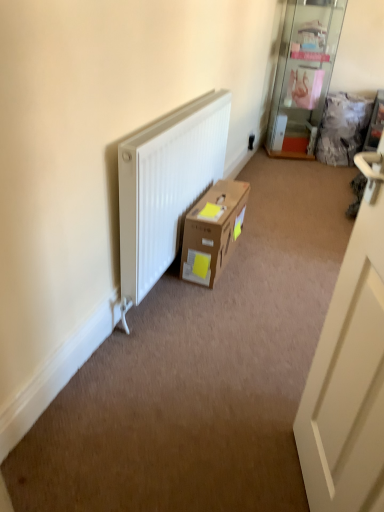
Describe the element at coordinates (303, 75) in the screenshot. I see `transparent glass shelf at upper right` at that location.

Locate an element on the screen. The width and height of the screenshot is (384, 512). white matte door at right is located at coordinates (349, 370).

Where is `brown cardboard box at center`? brown cardboard box at center is located at coordinates (213, 232).

Considering the relative sizes of brown cardboard box at center and transparent glass shelf at upper right in the image provided, is brown cardboard box at center smaller than transparent glass shelf at upper right?

Correct, brown cardboard box at center occupies less space than transparent glass shelf at upper right.

Is point (224, 192) more distant than point (299, 126)?

No, it is in front of (299, 126).

In the image, is brown cardboard box at center positioned in front of or behind transparent glass shelf at upper right?

brown cardboard box at center is positioned closer to the viewer than transparent glass shelf at upper right.

Considering the positions of objects transparent glass shelf at upper right and white matte door at right in the image provided, who is more to the left, transparent glass shelf at upper right or white matte door at right?

From the viewer's perspective, white matte door at right appears more on the left side.

Who is shorter, transparent glass shelf at upper right or white matte door at right?

transparent glass shelf at upper right is shorter.

From a real-world perspective, is transparent glass shelf at upper right above or below white matte door at right?

transparent glass shelf at upper right is situated lower than white matte door at right in the real world.

Is transparent glass shelf at upper right oriented towards white matte door at right?

Yes, transparent glass shelf at upper right faces towards white matte door at right.

Is transparent glass shelf at upper right positioned far away from brown cardboard box at center?

Indeed, transparent glass shelf at upper right is not near brown cardboard box at center.

Is transparent glass shelf at upper right facing towards brown cardboard box at center?

Yes, transparent glass shelf at upper right is facing brown cardboard box at center.

Is transparent glass shelf at upper right completely or partially outside of brown cardboard box at center?

Yes.

Considering the positions of objects transparent glass shelf at upper right and brown cardboard box at center in the image provided, who is in front, transparent glass shelf at upper right or brown cardboard box at center?

Result: brown cardboard box at center is closer to the camera.

Based on the photo, from a real-world perspective, which is physically below, brown cardboard box at center or white matte door at right?

From a 3D spatial view, brown cardboard box at center is below.

Does point (227, 223) appear closer or farther from the camera than point (357, 403)?

Point (227, 223).

At what (x,y) coordinates should I click in order to perform the action: click on door on the right of brown cardboard box at center. Please return your answer as a coordinate pair (x, y). This screenshot has width=384, height=512. Looking at the image, I should click on (349, 370).

Which of these two, white matte door at right or brown cardboard box at center, is thinner?

With smaller width is white matte door at right.

Between white matte door at right and brown cardboard box at center, which one has larger size?

white matte door at right.

Which of these two, white matte door at right or brown cardboard box at center, stands shorter?

With less height is brown cardboard box at center.

Is white matte door at right facing away from transparent glass shelf at upper right?

No, white matte door at right is not facing the opposite direction of transparent glass shelf at upper right.

Considering the relative sizes of white matte door at right and transparent glass shelf at upper right in the image provided, is white matte door at right wider than transparent glass shelf at upper right?

No, white matte door at right is not wider than transparent glass shelf at upper right.

Is white matte door at right at the left side of transparent glass shelf at upper right?

Yes.

The height and width of the screenshot is (512, 384). I want to click on shelf above the brown cardboard box at center (from a real-world perspective), so click(303, 75).

In order to click on shelf on the right of white matte door at right in this screenshot , I will do `click(303, 75)`.

Based on their spatial positions, is white matte door at right or brown cardboard box at center further from transparent glass shelf at upper right?

white matte door at right lies further to transparent glass shelf at upper right than the other object.

From the image, which object appears to be farther from brown cardboard box at center, white matte door at right or transparent glass shelf at upper right?

transparent glass shelf at upper right lies further to brown cardboard box at center than the other object.

Consider the image. Based on their spatial positions, is brown cardboard box at center or transparent glass shelf at upper right further from white matte door at right?

The object further to white matte door at right is transparent glass shelf at upper right.

Looking at the image, which one is located further to white matte door at right, transparent glass shelf at upper right or brown cardboard box at center?

The object further to white matte door at right is transparent glass shelf at upper right.

Consider the image. From the image, which object appears to be farther from transparent glass shelf at upper right, brown cardboard box at center or white matte door at right?

white matte door at right is positioned further to the anchor transparent glass shelf at upper right.

Which object lies nearer to the anchor point brown cardboard box at center, transparent glass shelf at upper right or white matte door at right?

white matte door at right is closer to brown cardboard box at center.

Where is `box between white matte door at right and transparent glass shelf at upper right along the z-axis`? Image resolution: width=384 pixels, height=512 pixels. box between white matte door at right and transparent glass shelf at upper right along the z-axis is located at coordinates [x=213, y=232].